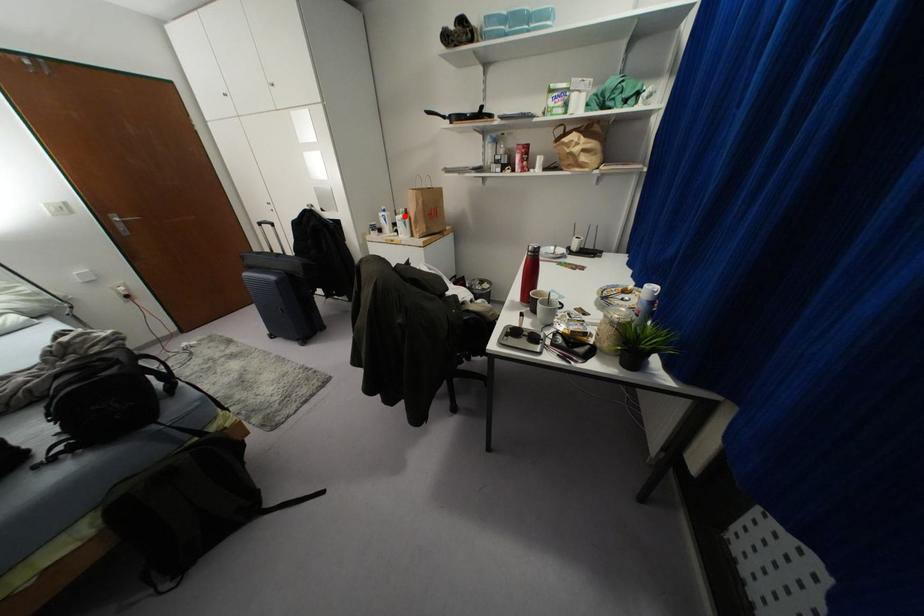
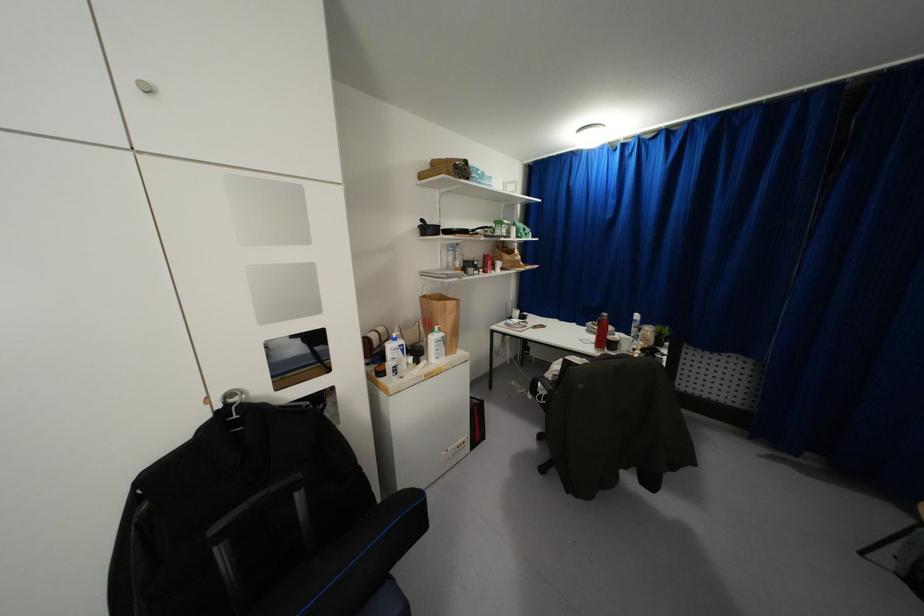
Question: A red point is marked in image1. In image2, is the corresponding 3D point closer to the camera or farther? Reply with the corresponding letter.

Choices:
 (A) The corresponding 3D point is closer.
 (B) The corresponding 3D point is farther.

Answer: (B)